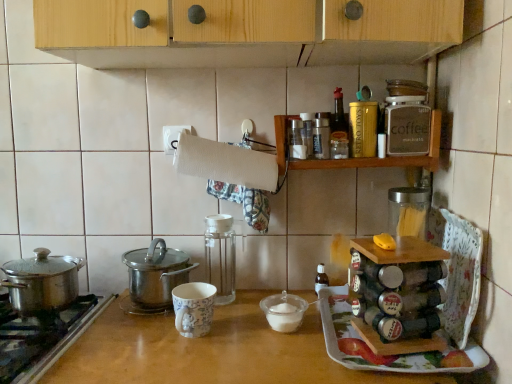
Question: Does matte brown coffee container at upper right, which appears as the 6th kitchen appliance when viewed from the left, touch porcelain floral mug at center?

Choices:
 (A) no
 (B) yes

Answer: (A)

Question: Can you confirm if matte brown coffee container at upper right, which appears as the 6th kitchen appliance when viewed from the left, is smaller than porcelain floral mug at center?

Choices:
 (A) yes
 (B) no

Answer: (A)

Question: Does matte brown coffee container at upper right, which appears as the 6th kitchen appliance when viewed from the left, appear on the right side of porcelain floral mug at center?

Choices:
 (A) yes
 (B) no

Answer: (A)

Question: Is matte brown coffee container at upper right, which appears as the 6th kitchen appliance when viewed from the left, wider than porcelain floral mug at center?

Choices:
 (A) no
 (B) yes

Answer: (A)

Question: From a real-world perspective, is matte brown coffee container at upper right, placed as the second kitchen appliance when sorted from right to left, under porcelain floral mug at center?

Choices:
 (A) yes
 (B) no

Answer: (B)

Question: Is matte brown coffee container at upper right, which appears as the 6th kitchen appliance when viewed from the left, in front of porcelain floral mug at center?

Choices:
 (A) yes
 (B) no

Answer: (B)

Question: Does white paper towel at upper center have a lesser height compared to wooden spice rack at upper right?

Choices:
 (A) yes
 (B) no

Answer: (A)

Question: From the image's perspective, is white paper towel at upper center on top of wooden spice rack at upper right?

Choices:
 (A) no
 (B) yes

Answer: (A)

Question: Can you confirm if white paper towel at upper center is wider than wooden spice rack at upper right?

Choices:
 (A) yes
 (B) no

Answer: (B)

Question: Is white paper towel at upper center further to the viewer compared to wooden spice rack at upper right?

Choices:
 (A) yes
 (B) no

Answer: (B)

Question: Does white paper towel at upper center turn towards wooden spice rack at upper right?

Choices:
 (A) no
 (B) yes

Answer: (A)

Question: Does white paper towel at upper center have a greater height compared to wooden spice rack at upper right?

Choices:
 (A) no
 (B) yes

Answer: (A)

Question: Can you confirm if transparent glass spice rack at center, which is the 5th kitchen appliance in right-to-left order, is taller than white plastic bowl at center, the 2th appliance positioned from the right?

Choices:
 (A) no
 (B) yes

Answer: (B)